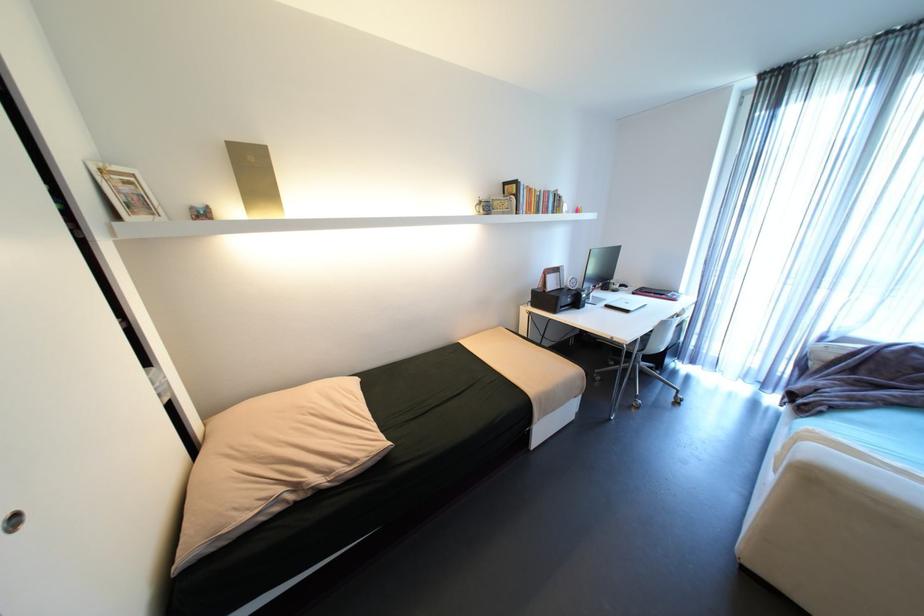
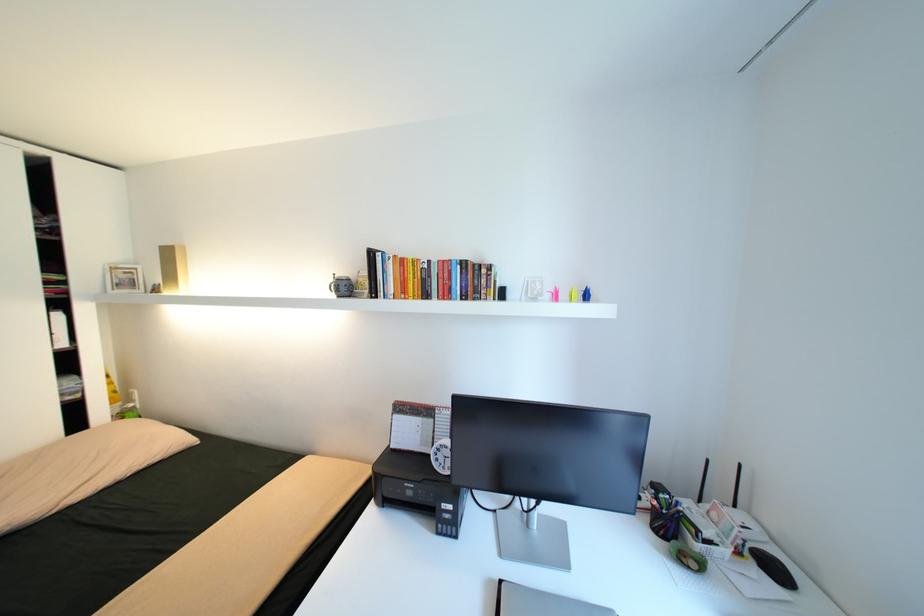
The point at (x=552, y=191) is marked in the first image. Where is the corresponding point in the second image?

(445, 262)